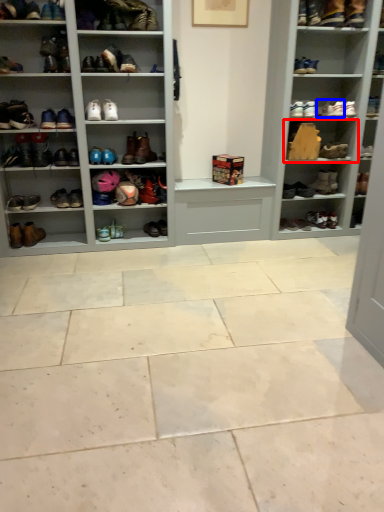
Question: Among these objects, which one is nearest to the camera, shelf (highlighted by a red box) or shoe (highlighted by a blue box)?

Choices:
 (A) shelf
 (B) shoe

Answer: (B)